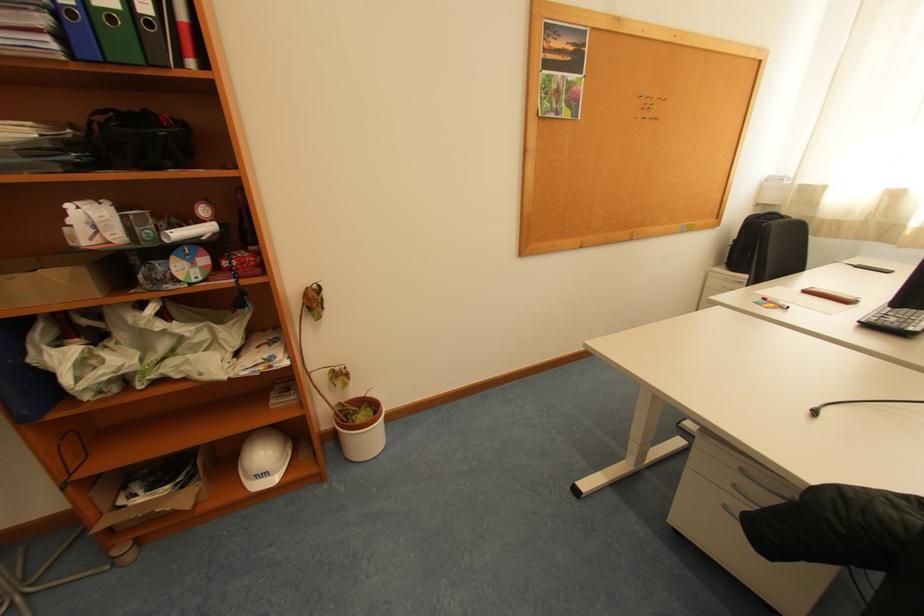
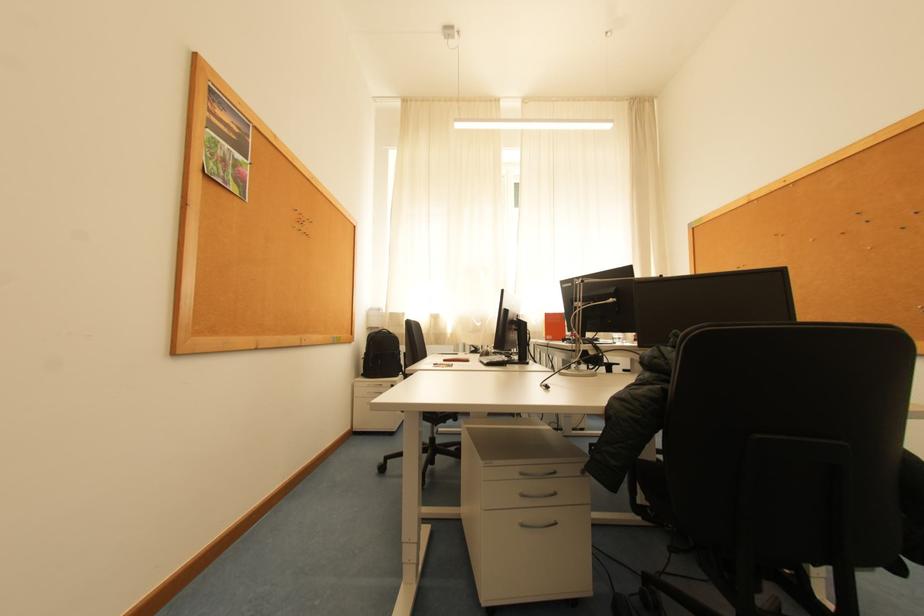
In the second image, find the point that corresponds to point (749, 471) in the first image.

(529, 475)